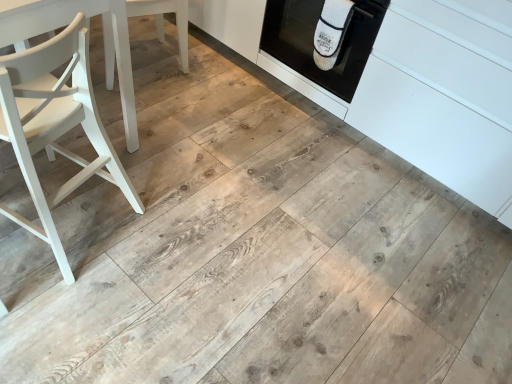
Question: In the image, is white ribbed oven mitt at upper right positioned in front of or behind white matte cabinetry at center?

Choices:
 (A) behind
 (B) front

Answer: (A)

Question: Based on their sizes in the image, would you say white ribbed oven mitt at upper right is bigger or smaller than white matte cabinetry at center?

Choices:
 (A) big
 (B) small

Answer: (B)

Question: Which object is the farthest from the white ribbed oven mitt at upper right?

Choices:
 (A) white painted wood chair at left, which is counted as the 1th chair, starting from the bottom
 (B) white matte cabinetry at center
 (C) white matte wood chair at left, which is the 2th chair from bottom to top
 (D) white ribbed oven mitt at upper right

Answer: (A)

Question: Considering the real-world distances, which object is closest to the white painted wood chair at left, which is counted as the 1th chair, starting from the bottom?

Choices:
 (A) white matte wood chair at left, the 2th chair positioned from the front
 (B) white ribbed oven mitt at upper right
 (C) white ribbed oven mitt at upper right
 (D) white matte cabinetry at center

Answer: (A)